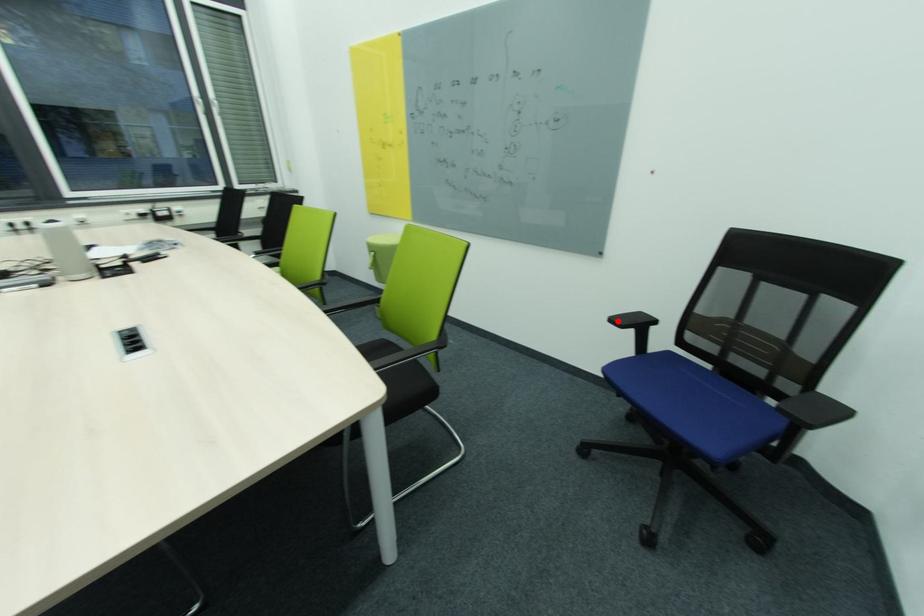
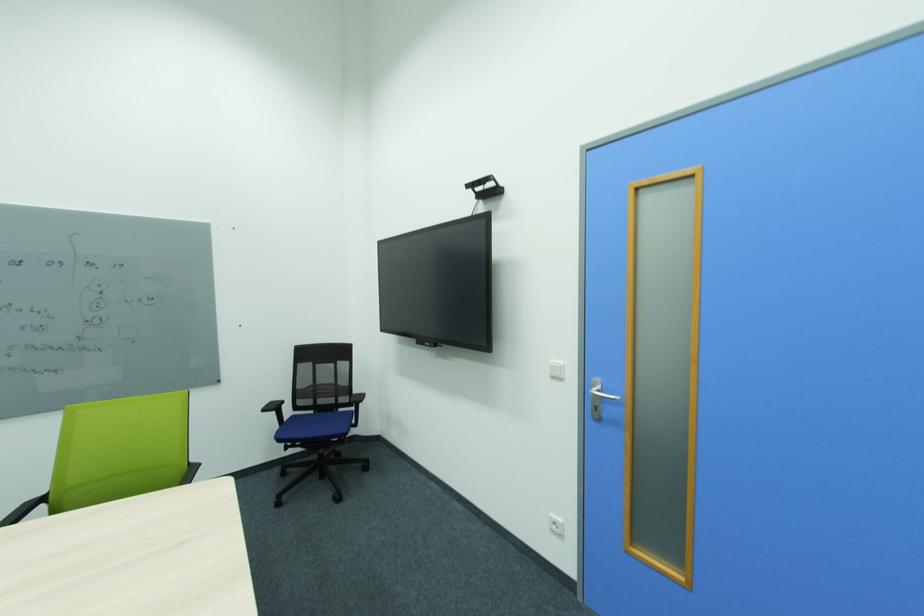
The point at the highlighted location is marked in the first image. Where is the corresponding point in the second image?

(270, 411)